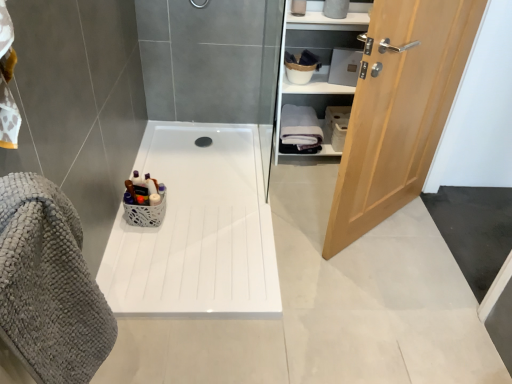
You are a GUI agent. You are given a task and a screenshot of the screen. Output one action in this format:
    pyautogui.click(x=<x>, y=<y>)
    Task: Click on the free point behind black rubber drain at center
    
    Given the screenshot: What is the action you would take?
    pyautogui.click(x=206, y=126)